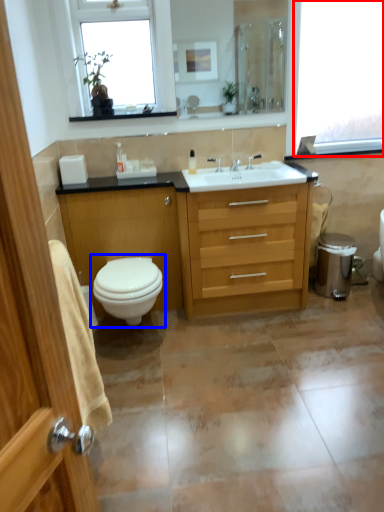
Question: Which object appears farthest to the camera in this image, window (highlighted by a red box) or toilet (highlighted by a blue box)?

Choices:
 (A) window
 (B) toilet

Answer: (A)